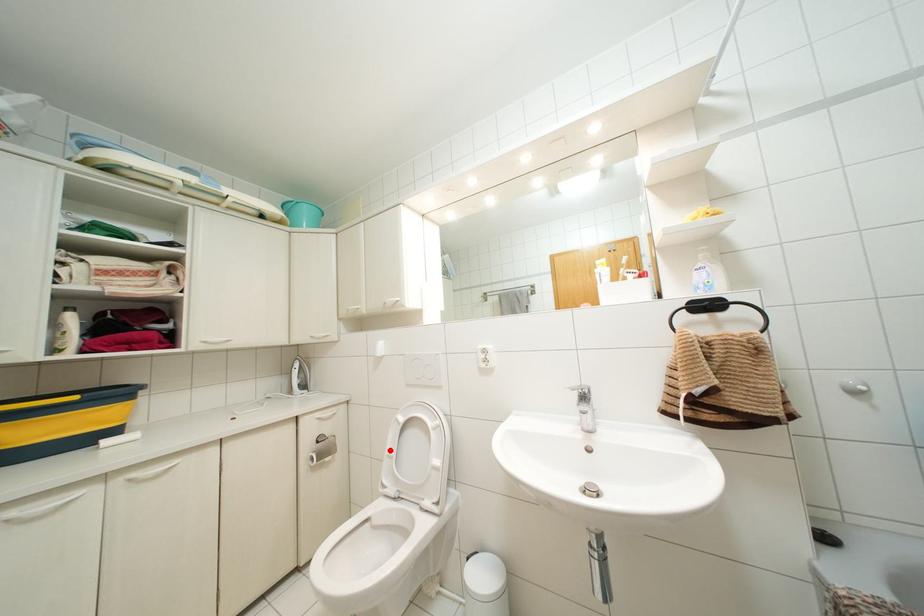
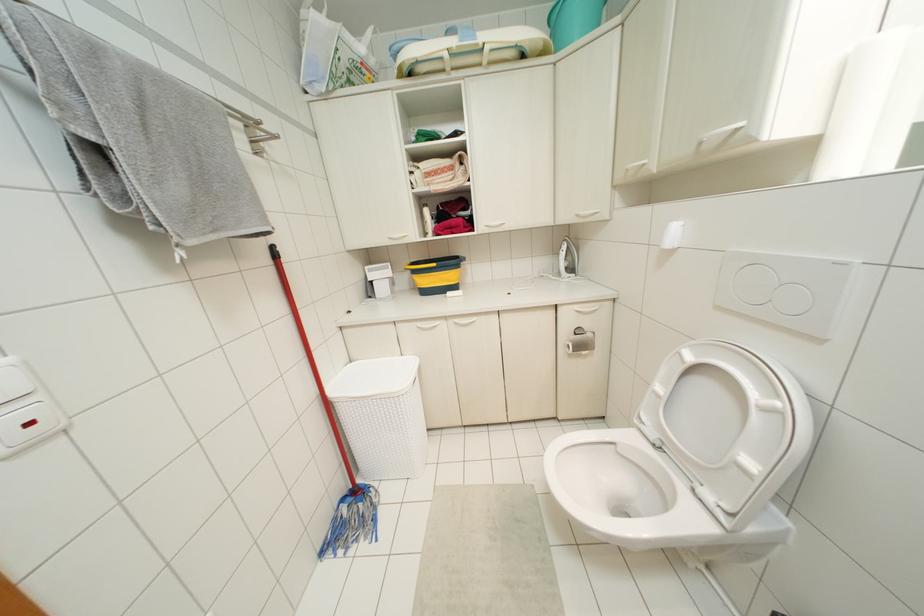
Question: I am providing you with two images of the same scene from different viewpoints. Given a red point in image1, look at the same physical point in image2. Is it:

Choices:
 (A) Closer to the viewpoint
 (B) Farther from the viewpoint

Answer: (A)